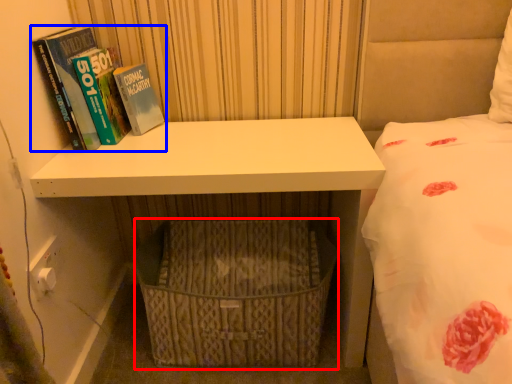
Question: Among these objects, which one is farthest to the camera, basket (highlighted by a red box) or book (highlighted by a blue box)?

Choices:
 (A) basket
 (B) book

Answer: (A)